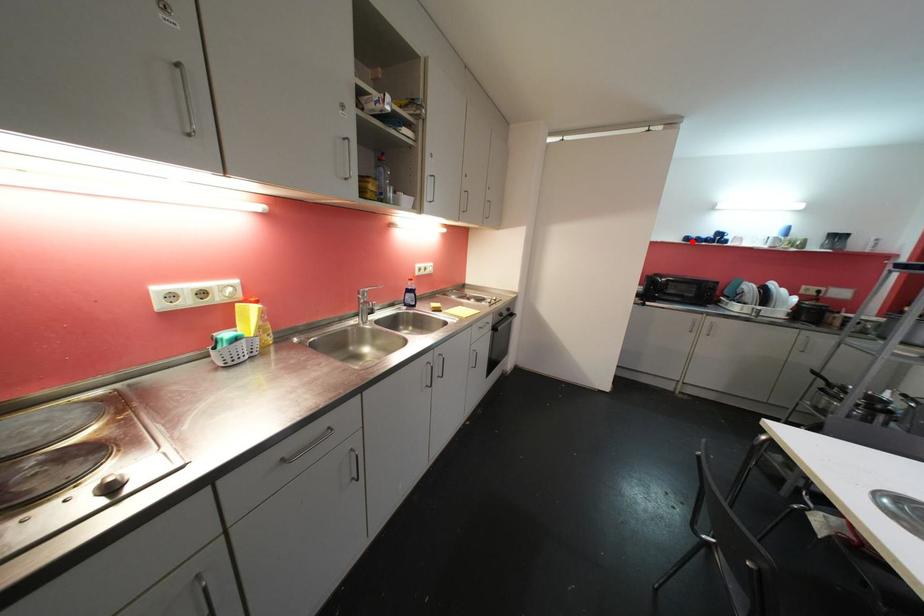
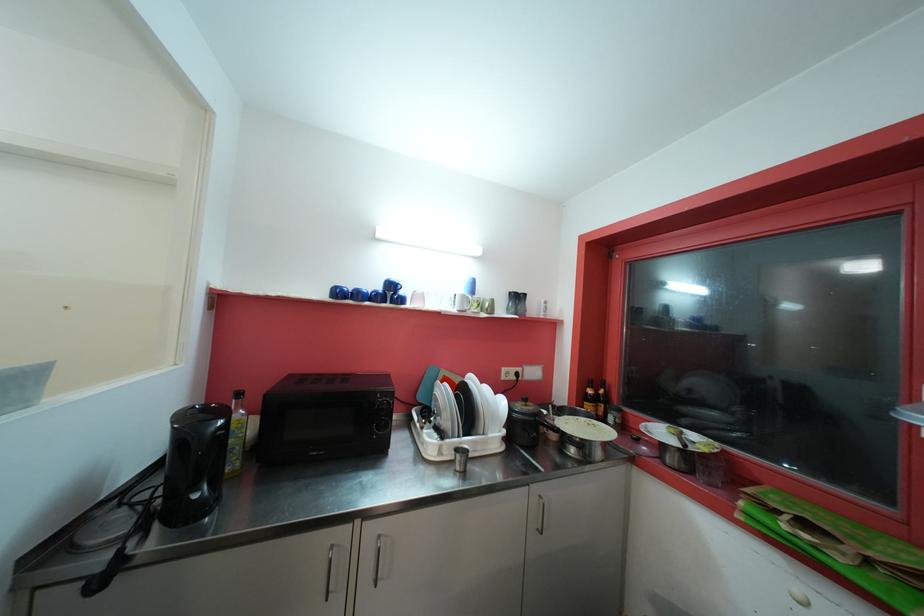
Locate, in the second image, the point that corresponds to the highlighted location in the first image.

(343, 294)